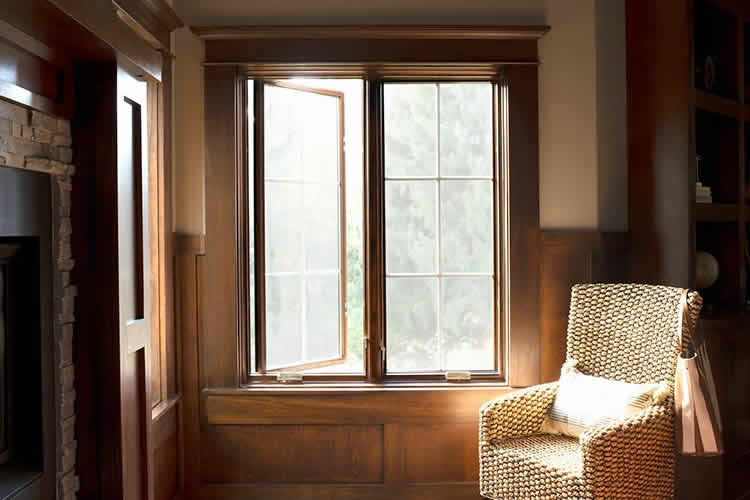
Image resolution: width=750 pixels, height=500 pixels. In order to click on fireplace in this screenshot , I will do `click(31, 200)`.